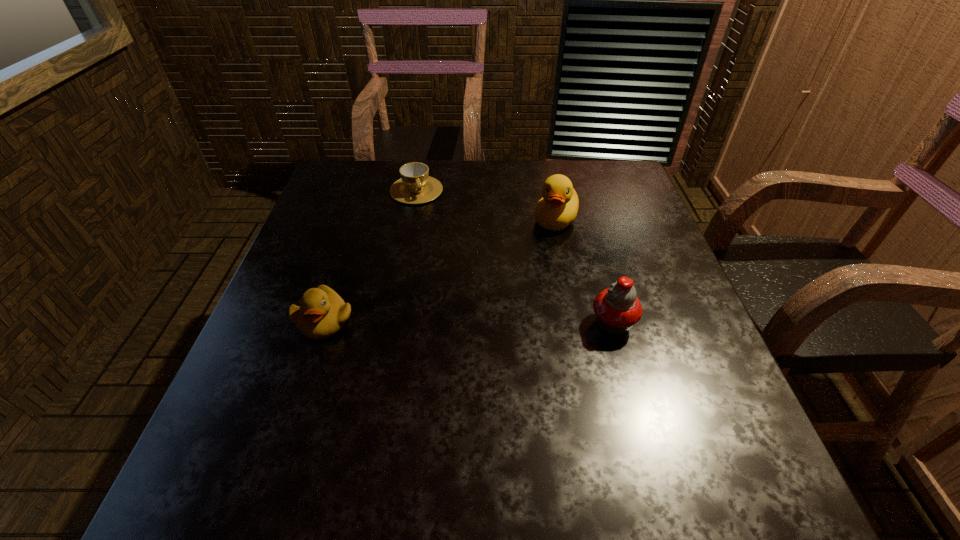
The width and height of the screenshot is (960, 540). Identify the location of vacant spot on the desktop that is between the duckling and the cupcake and is positioned with the handle on the side of the second object from left to right. (470, 322).

Where is `vacant spot on the desktop that is between the duckling and the cupcake and is positioned at the beak of the duck`? vacant spot on the desktop that is between the duckling and the cupcake and is positioned at the beak of the duck is located at coordinates (489, 322).